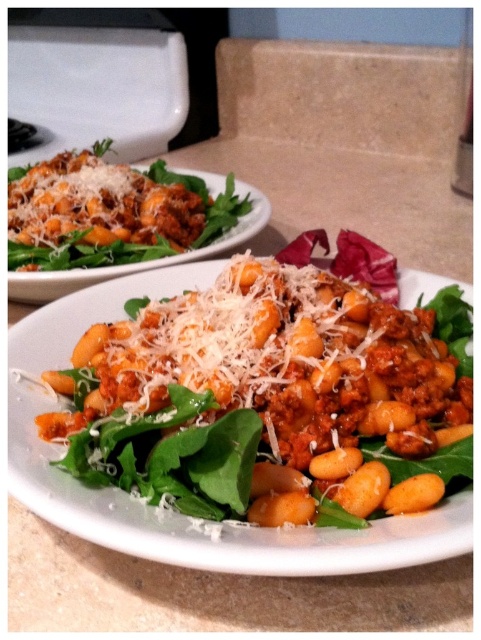
Question: Which point is closer to the camera?

Choices:
 (A) matte brown gnocchi at center
 (B) matte orange gnocchi at center

Answer: (B)

Question: Can you confirm if matte orange gnocchi at center is bigger than matte brown gnocchi at center?

Choices:
 (A) yes
 (B) no

Answer: (B)

Question: Which point is closer to the camera taking this photo?

Choices:
 (A) (52, 330)
 (B) (25, 284)

Answer: (A)

Question: Is matte orange gnocchi at center smaller than matte brown gnocchi at center?

Choices:
 (A) yes
 (B) no

Answer: (A)

Question: Can you confirm if matte orange gnocchi at center is bigger than matte brown gnocchi at center?

Choices:
 (A) no
 (B) yes

Answer: (A)